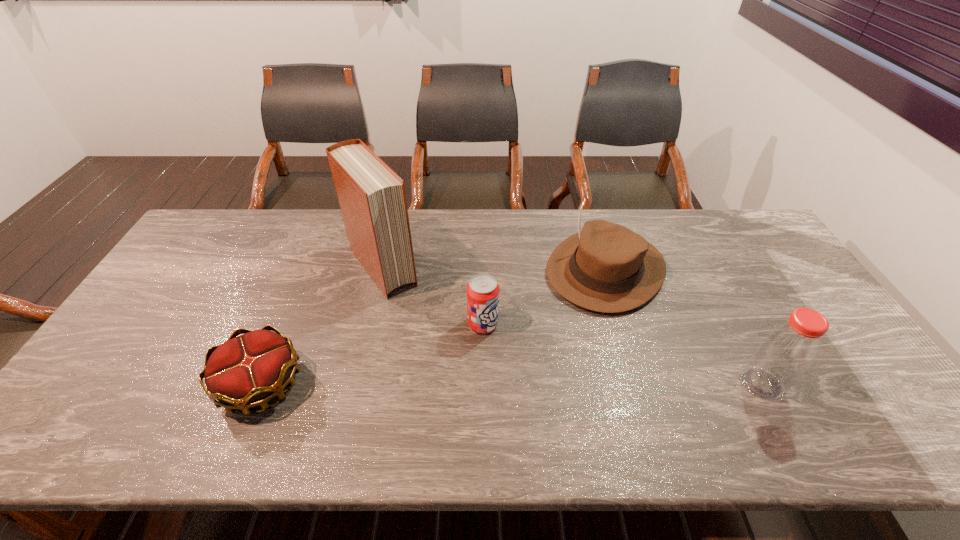
This screenshot has height=540, width=960. Find the location of `empty space between the fourth object from left to right and the crown`. empty space between the fourth object from left to right and the crown is located at coordinates (433, 327).

Where is `unoccupied position between the bottle and the second object from right to left`? The image size is (960, 540). unoccupied position between the bottle and the second object from right to left is located at coordinates (684, 327).

I want to click on vacant point located between the third tallest object and the third object from left to right, so click(x=544, y=296).

Identify the location of free spot between the leftmost object and the hardback book. This screenshot has width=960, height=540. (323, 326).

The width and height of the screenshot is (960, 540). I want to click on unoccupied position between the third object from right to left and the bottle, so click(622, 354).

The image size is (960, 540). Find the location of `vacant area between the fedora and the rightmost object`. vacant area between the fedora and the rightmost object is located at coordinates (684, 327).

Image resolution: width=960 pixels, height=540 pixels. I want to click on free space between the third object from right to left and the third tallest object, so click(544, 296).

You are a GUI agent. You are given a task and a screenshot of the screen. Output one action in this format:
    pyautogui.click(x=<x>, y=<y>)
    Task: Click on the blank region between the rightmost object and the leftmost object
    
    Given the screenshot: What is the action you would take?
    pyautogui.click(x=512, y=384)

Where is `vacant area that lies between the rightmost object and the fourth object from left to right`? This screenshot has width=960, height=540. vacant area that lies between the rightmost object and the fourth object from left to right is located at coordinates (684, 327).

Where is `vacant area that lies between the second shortest object and the hardback book`? vacant area that lies between the second shortest object and the hardback book is located at coordinates (433, 296).